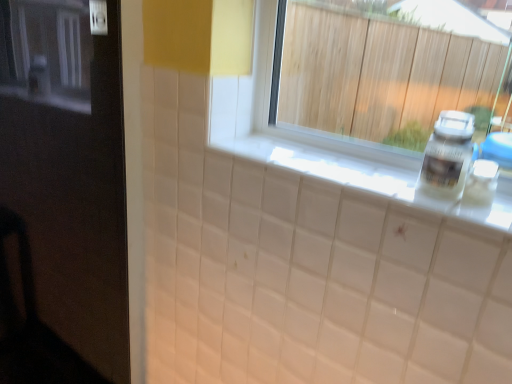
Question: From a real-world perspective, is black glossy door at left located higher than white plastic bottle at right?

Choices:
 (A) no
 (B) yes

Answer: (A)

Question: Considering the relative sizes of black glossy door at left and white plastic bottle at right in the image provided, is black glossy door at left bigger than white plastic bottle at right?

Choices:
 (A) no
 (B) yes

Answer: (B)

Question: Is black glossy door at left located outside white plastic bottle at right?

Choices:
 (A) yes
 (B) no

Answer: (A)

Question: Is white plastic bottle at right inside black glossy door at left?

Choices:
 (A) no
 (B) yes

Answer: (A)

Question: Does black glossy door at left have a smaller size compared to white plastic bottle at right?

Choices:
 (A) yes
 (B) no

Answer: (B)

Question: Considering the relative positions of black glossy door at left and white plastic bottle at right in the image provided, is black glossy door at left behind white plastic bottle at right?

Choices:
 (A) no
 (B) yes

Answer: (A)

Question: Is white glossy counter top at center touching black glossy door at left?

Choices:
 (A) yes
 (B) no

Answer: (B)

Question: Considering the relative positions of white glossy counter top at center and black glossy door at left in the image provided, is white glossy counter top at center in front of black glossy door at left?

Choices:
 (A) yes
 (B) no

Answer: (B)

Question: Could black glossy door at left be considered to be inside white glossy counter top at center?

Choices:
 (A) yes
 (B) no

Answer: (B)

Question: Can you confirm if white glossy counter top at center is shorter than black glossy door at left?

Choices:
 (A) no
 (B) yes

Answer: (B)

Question: Does white glossy counter top at center have a smaller size compared to black glossy door at left?

Choices:
 (A) no
 (B) yes

Answer: (B)

Question: Is white glossy counter top at center bigger than black glossy door at left?

Choices:
 (A) yes
 (B) no

Answer: (B)

Question: Considering the relative positions of white plastic bottle at right and white glossy counter top at center in the image provided, is white plastic bottle at right to the left of white glossy counter top at center from the viewer's perspective?

Choices:
 (A) yes
 (B) no

Answer: (B)